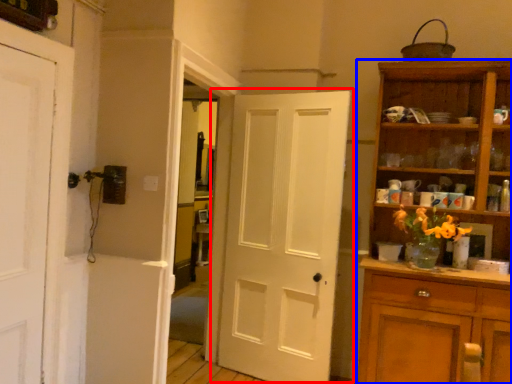
Question: Which object is closer to the camera taking this photo, door (highlighted by a red box) or cupboard (highlighted by a blue box)?

Choices:
 (A) door
 (B) cupboard

Answer: (B)